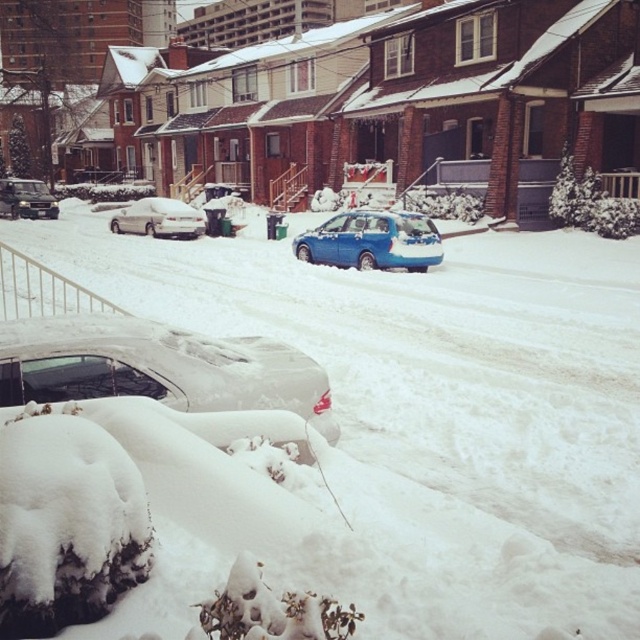
Can you confirm if white fluffy snow at lower left is positioned to the left of snow-covered silver sedan at lower left?

Incorrect, white fluffy snow at lower left is not on the left side of snow-covered silver sedan at lower left.

Locate an element on the screen. white fluffy snow at lower left is located at coordinates (428, 355).

Does snow-covered silver sedan at lower left have a greater height compared to white matte sedan at center?

No, snow-covered silver sedan at lower left is not taller than white matte sedan at center.

Is snow-covered silver sedan at lower left closer to camera compared to white matte sedan at center?

Yes.

The height and width of the screenshot is (640, 640). Describe the element at coordinates (157, 368) in the screenshot. I see `snow-covered silver sedan at lower left` at that location.

Where is `snow-covered silver sedan at lower left`? This screenshot has width=640, height=640. snow-covered silver sedan at lower left is located at coordinates tap(157, 368).

In the scene shown: Does snow-covered silver sedan at lower left have a greater width compared to matte black suv at left?

No.

Is snow-covered silver sedan at lower left further to camera compared to matte black suv at left?

No, it is in front of matte black suv at left.

Is point (129, 332) in front of point (8, 200)?

Yes, it is in front of point (8, 200).

Identify the location of snow-covered silver sedan at lower left. The width and height of the screenshot is (640, 640). (157, 368).